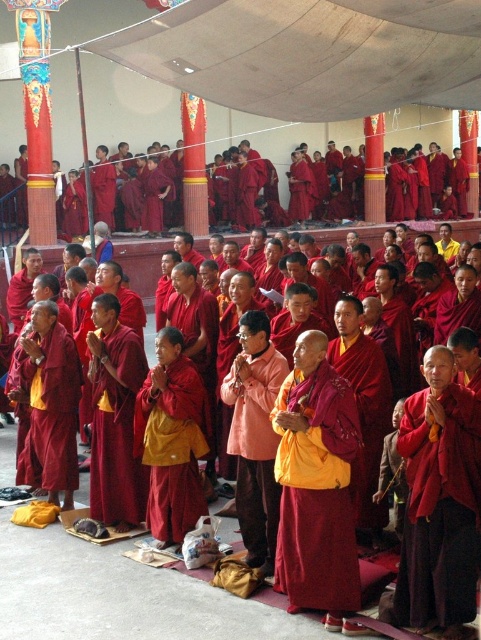
You are a photographer positioned at the front of the gathering. You want to take a photo that includes both the yellow matte robe at center and the matte red robe at center. Which robe will appear larger in the photo?

The yellow matte robe at center will appear larger in the photo because it is closer to the viewer than the matte red robe at center.

You are an observer at the back of the gathering. You notice two robes at the center of the scene. Which robe, the yellow matte robe at center or the matte red robe at center, would appear bigger to you?

The yellow matte robe at center has a larger size compared to the matte red robe at center, so it would appear bigger to you.

You are an observer standing in front of the group under the canopy. You notice two robes at the center of the scene. Which robe is positioned to the right when looking at the yellow matte robe at center and the maroon silk robe at center?

The yellow matte robe at center is positioned to the right of the maroon silk robe at center.